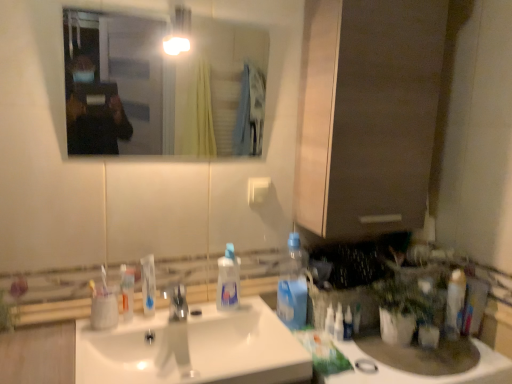
You are a GUI agent. You are given a task and a screenshot of the screen. Output one action in this format:
    pyautogui.click(x=<x>, y=<y>)
    Task: Click on the vacant point to the right of clear plastic spray bottle at right, placed as the first cleaning product when sorted from right to left
    This screenshot has height=384, width=512.
    Given the screenshot: What is the action you would take?
    pyautogui.click(x=379, y=348)